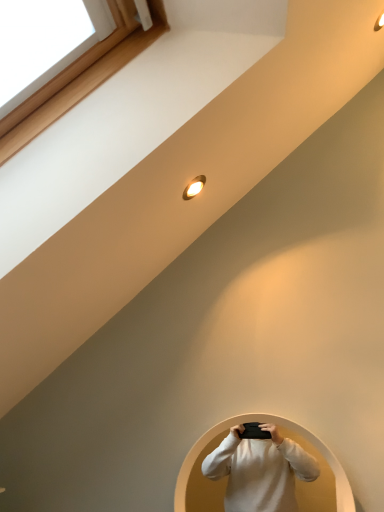
What do you see at coordinates (260, 472) in the screenshot? I see `white matte sweatshirt at center` at bounding box center [260, 472].

This screenshot has height=512, width=384. I want to click on white matte sweatshirt at center, so click(x=260, y=472).

You are a GUI agent. You are given a task and a screenshot of the screen. Output one action in this format:
    pyautogui.click(x=<x>, y=<y>)
    Task: Click on the white matte sweatshirt at center
    The width and height of the screenshot is (384, 512).
    Given the screenshot: What is the action you would take?
    (260, 472)